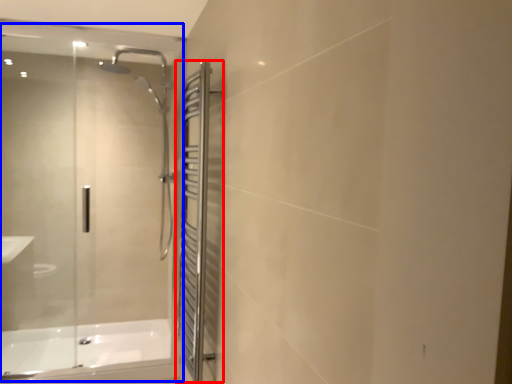
Question: Which of the following is the closest to the observer, screen door (highlighted by a red box) or glass door (highlighted by a blue box)?

Choices:
 (A) screen door
 (B) glass door

Answer: (A)